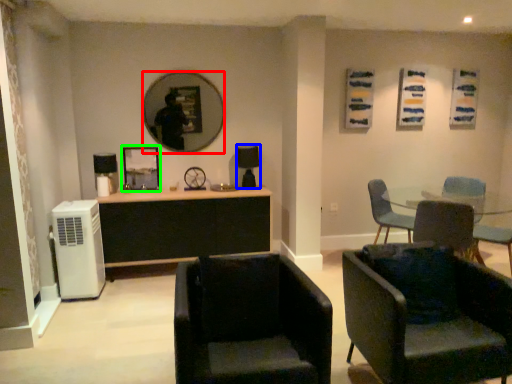
Question: Which object is the closest to the mirror (highlighted by a red box)? Choose among these: lamp (highlighted by a blue box) or picture frame (highlighted by a green box).

Choices:
 (A) lamp
 (B) picture frame

Answer: (B)